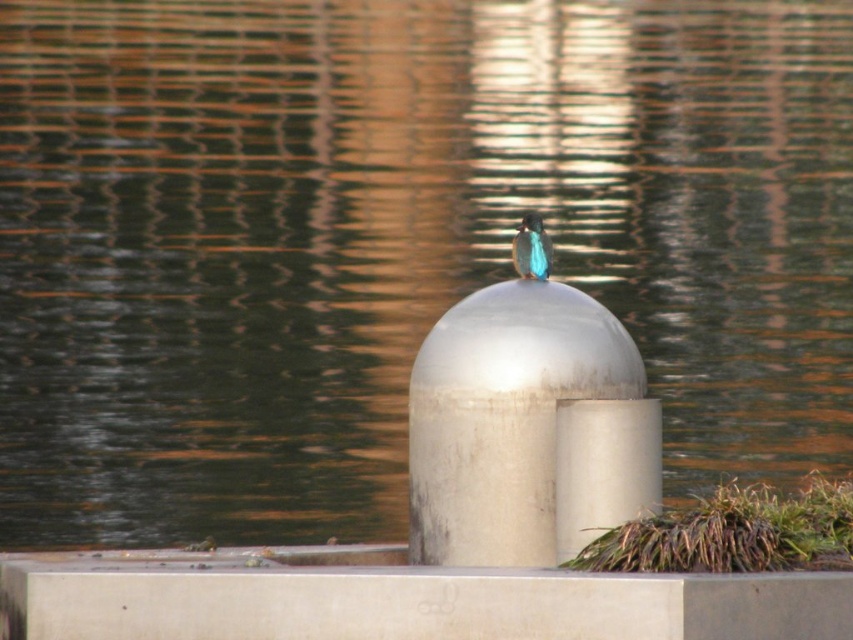
Question: Which of the following is the farthest from the observer?

Choices:
 (A) (450, 387)
 (B) (534, 256)

Answer: (B)

Question: Which object is farther from the camera taking this photo?

Choices:
 (A) satin silver dome at center
 (B) blue glossy bird at center

Answer: (B)

Question: Is satin silver dome at center bigger than blue glossy bird at center?

Choices:
 (A) yes
 (B) no

Answer: (A)

Question: Can you confirm if satin silver dome at center is positioned above blue glossy bird at center?

Choices:
 (A) no
 (B) yes

Answer: (A)

Question: Does satin silver dome at center have a smaller size compared to blue glossy bird at center?

Choices:
 (A) yes
 (B) no

Answer: (B)